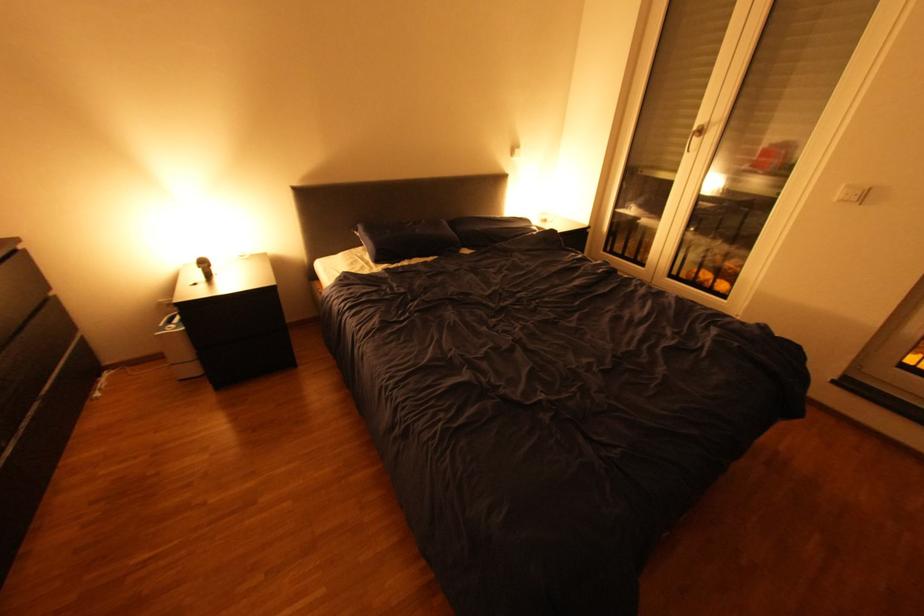
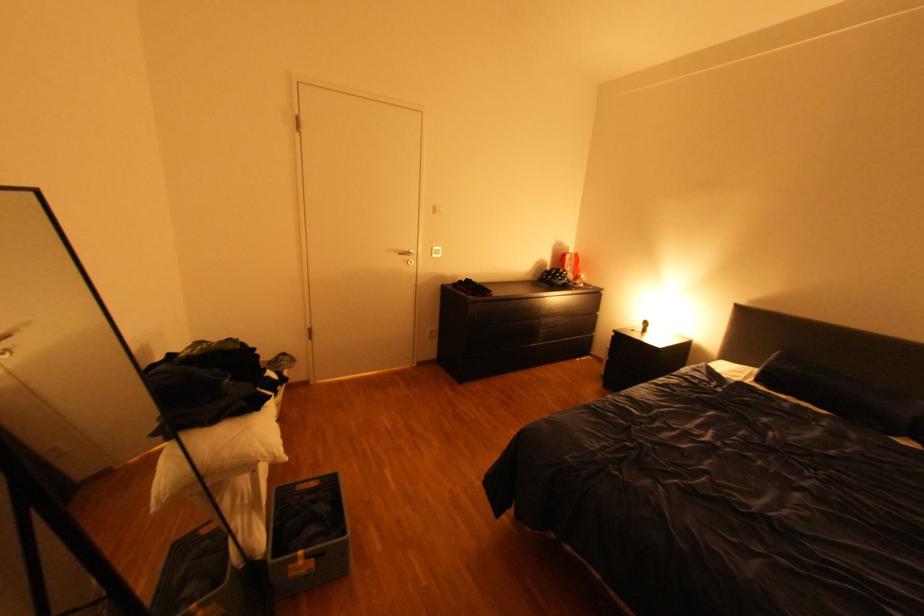
The point at [222,268] is marked in the first image. Where is the corresponding point in the second image?

(659, 328)